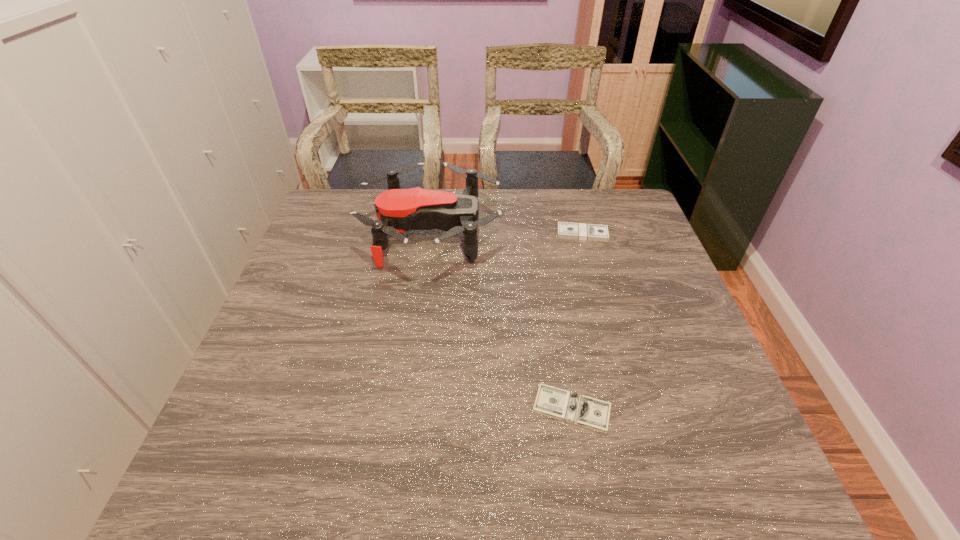
Identify the location of vacant space that is in between the nearer dollar and the drone. (502, 320).

This screenshot has width=960, height=540. Find the location of `empty location between the farther dollar and the shorter dollar`. empty location between the farther dollar and the shorter dollar is located at coordinates (577, 321).

The width and height of the screenshot is (960, 540). Find the location of `vacant area that lies between the tallest object and the nearest object`. vacant area that lies between the tallest object and the nearest object is located at coordinates (502, 320).

The image size is (960, 540). Find the location of `free point between the shorter dollar and the second tallest object`. free point between the shorter dollar and the second tallest object is located at coordinates (577, 321).

This screenshot has width=960, height=540. Identify the location of unoccupied position between the taller dollar and the nearest object. (577, 321).

Where is `vacant space that is in between the taller dollar and the shortest object`? This screenshot has width=960, height=540. vacant space that is in between the taller dollar and the shortest object is located at coordinates (577, 321).

At what (x,y) coordinates should I click in order to perform the action: click on free space between the taller dollar and the nearer dollar. Please return your answer as a coordinate pair (x, y). The image size is (960, 540). Looking at the image, I should click on [577, 321].

Find the location of a particular element. free space between the tallest object and the second shortest object is located at coordinates (507, 233).

Where is `free area in between the farther dollar and the leftmost object`? free area in between the farther dollar and the leftmost object is located at coordinates (507, 233).

The height and width of the screenshot is (540, 960). I want to click on free space between the leftmost object and the farther dollar, so click(x=507, y=233).